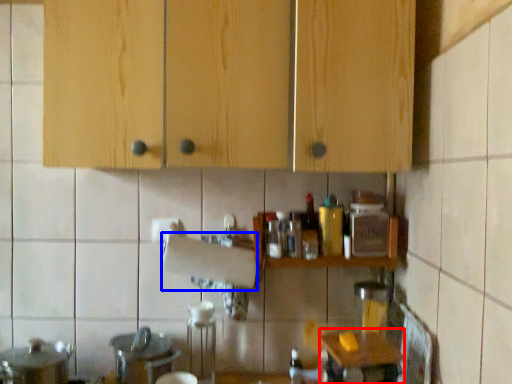
Question: Which object is further to the camera taking this photo, table (highlighted by a red box) or paper towel (highlighted by a blue box)?

Choices:
 (A) table
 (B) paper towel

Answer: (B)